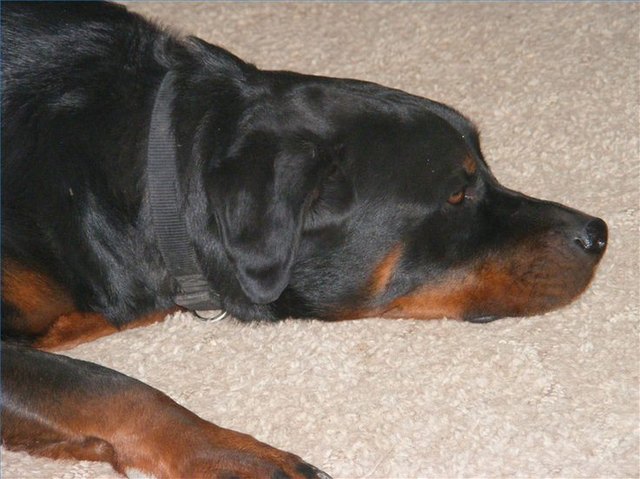
At what (x,y) coordinates should I click in order to perform the action: click on carpet. Please return your answer as a coordinate pair (x, y). This screenshot has width=640, height=479. Looking at the image, I should click on (276, 382), (546, 437), (621, 350), (604, 161), (596, 29), (282, 16), (491, 53), (22, 466).